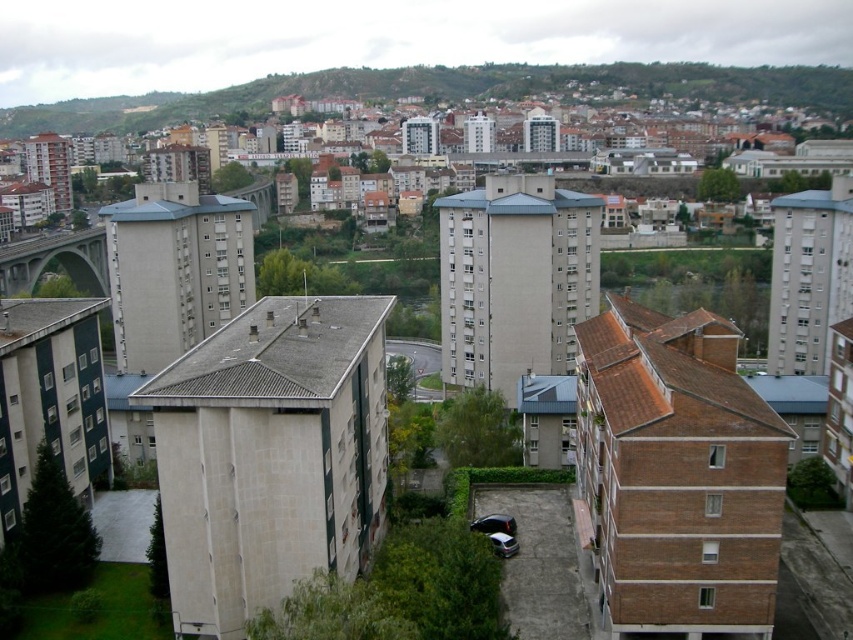
You are a delivery driver who needs to park your vehicle in a space that can only accommodate cars shorter than 4 meters. You see the shiny black car at center and the silver metallic car at center in the parking lot. Which car would fit in the space?

The shiny black car at center is shorter than the silver metallic car at center, so it would fit in the parking space designed for cars shorter than 4 meters.

You are standing at point (x=445, y=92) in the urban landscape. What do you see around you?

At point (x=445, y=92) lies green grassy hillside at upper center.

Consider the image. You are a drone operator who needs to fly a drone from the green grassy hillside at upper center to the silver metallic car at center. Considering the height difference between them, will the drone have to ascend or descend during this flight?

The green grassy hillside at upper center is much taller than the silver metallic car at center, so the drone will have to descend during the flight.